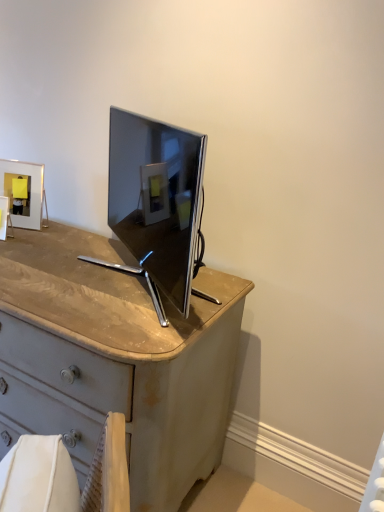
Where is `matte white picture frame at upper left, positioned as the first picture frame in front-to-back order`? The width and height of the screenshot is (384, 512). matte white picture frame at upper left, positioned as the first picture frame in front-to-back order is located at coordinates (3, 217).

The width and height of the screenshot is (384, 512). What do you see at coordinates (3, 217) in the screenshot?
I see `matte white picture frame at upper left, the 2th picture frame from the back` at bounding box center [3, 217].

Find the location of a particular element. This screenshot has width=384, height=512. matte silver picture frame at upper left, arranged as the 2th picture frame when viewed from the front is located at coordinates (23, 192).

What is the approximate height of matte silver picture frame at upper left, arranged as the 2th picture frame when viewed from the front?

The height of matte silver picture frame at upper left, arranged as the 2th picture frame when viewed from the front, is 10.74 inches.

This screenshot has height=512, width=384. Describe the element at coordinates (23, 192) in the screenshot. I see `matte silver picture frame at upper left, arranged as the 2th picture frame when viewed from the front` at that location.

Find the location of a particular element. matte white picture frame at upper left, the 2th picture frame from the back is located at coordinates (3, 217).

Which is more to the right, matte white picture frame at upper left, positioned as the first picture frame in front-to-back order, or matte silver picture frame at upper left, the first picture frame viewed from the back?

Positioned to the right is matte silver picture frame at upper left, the first picture frame viewed from the back.

Looking at this image, is matte white picture frame at upper left, the 2th picture frame from the back, in front of matte silver picture frame at upper left, arranged as the 2th picture frame when viewed from the front?

Yes.

Which is in front, point (5, 209) or point (6, 187)?

The point (5, 209) is closer to the camera.

From the image's perspective, who appears lower, matte white picture frame at upper left, the 2th picture frame from the back, or matte silver picture frame at upper left, arranged as the 2th picture frame when viewed from the front?

matte white picture frame at upper left, the 2th picture frame from the back.

From the picture: From a real-world perspective, who is located lower, matte white picture frame at upper left, positioned as the first picture frame in front-to-back order, or matte silver picture frame at upper left, the first picture frame viewed from the back?

matte white picture frame at upper left, positioned as the first picture frame in front-to-back order.

In terms of width, does matte white picture frame at upper left, positioned as the first picture frame in front-to-back order, look wider or thinner when compared to matte silver picture frame at upper left, the first picture frame viewed from the back?

Considering their sizes, matte white picture frame at upper left, positioned as the first picture frame in front-to-back order, looks slimmer than matte silver picture frame at upper left, the first picture frame viewed from the back.

Does matte white picture frame at upper left, positioned as the first picture frame in front-to-back order, have a lesser height compared to matte silver picture frame at upper left, the first picture frame viewed from the back?

Yes.

Is matte white picture frame at upper left, the 2th picture frame from the back, bigger or smaller than matte silver picture frame at upper left, arranged as the 2th picture frame when viewed from the front?

Clearly, matte white picture frame at upper left, the 2th picture frame from the back, is smaller in size than matte silver picture frame at upper left, arranged as the 2th picture frame when viewed from the front.

Which is correct: matte white picture frame at upper left, positioned as the first picture frame in front-to-back order, is inside matte silver picture frame at upper left, arranged as the 2th picture frame when viewed from the front, or outside of it?

The correct answer is: outside.

Is matte white picture frame at upper left, positioned as the first picture frame in front-to-back order, not near matte silver picture frame at upper left, the first picture frame viewed from the back?

matte white picture frame at upper left, positioned as the first picture frame in front-to-back order, is actually quite close to matte silver picture frame at upper left, the first picture frame viewed from the back.

Is matte white picture frame at upper left, the 2th picture frame from the back, turned away from matte silver picture frame at upper left, arranged as the 2th picture frame when viewed from the front?

Yes, matte white picture frame at upper left, the 2th picture frame from the back, is positioned with its back facing matte silver picture frame at upper left, arranged as the 2th picture frame when viewed from the front.

What's the angular difference between matte white picture frame at upper left, positioned as the first picture frame in front-to-back order, and matte silver picture frame at upper left, the first picture frame viewed from the back,'s facing directions?

The facing directions of matte white picture frame at upper left, positioned as the first picture frame in front-to-back order, and matte silver picture frame at upper left, the first picture frame viewed from the back, are 5.78 degrees apart.

How distant is matte white picture frame at upper left, positioned as the first picture frame in front-to-back order, from matte silver picture frame at upper left, the first picture frame viewed from the back?

The distance of matte white picture frame at upper left, positioned as the first picture frame in front-to-back order, from matte silver picture frame at upper left, the first picture frame viewed from the back, is 3.46 inches.

Where is `picture frame on the right of matte white picture frame at upper left, positioned as the first picture frame in front-to-back order`? This screenshot has width=384, height=512. picture frame on the right of matte white picture frame at upper left, positioned as the first picture frame in front-to-back order is located at coordinates (23, 192).

Does matte silver picture frame at upper left, the first picture frame viewed from the back, appear on the right side of matte white picture frame at upper left, positioned as the first picture frame in front-to-back order?

Indeed, matte silver picture frame at upper left, the first picture frame viewed from the back, is positioned on the right side of matte white picture frame at upper left, positioned as the first picture frame in front-to-back order.

Is matte silver picture frame at upper left, arranged as the 2th picture frame when viewed from the front, behind matte white picture frame at upper left, the 2th picture frame from the back?

Yes, the depth of matte silver picture frame at upper left, arranged as the 2th picture frame when viewed from the front, is greater than that of matte white picture frame at upper left, the 2th picture frame from the back.

Which is nearer, (28,208) or (2,203)?

Clearly, point (28,208) is more distant from the camera than point (2,203).

From the image's perspective, which one is positioned higher, matte silver picture frame at upper left, arranged as the 2th picture frame when viewed from the front, or matte white picture frame at upper left, the 2th picture frame from the back?

matte silver picture frame at upper left, arranged as the 2th picture frame when viewed from the front.

From a real-world perspective, which is physically above, matte silver picture frame at upper left, arranged as the 2th picture frame when viewed from the front, or matte white picture frame at upper left, positioned as the first picture frame in front-to-back order?

matte silver picture frame at upper left, arranged as the 2th picture frame when viewed from the front, from a real-world perspective.

Which object is thinner, matte silver picture frame at upper left, arranged as the 2th picture frame when viewed from the front, or matte white picture frame at upper left, positioned as the first picture frame in front-to-back order?

With smaller width is matte white picture frame at upper left, positioned as the first picture frame in front-to-back order.

Between matte silver picture frame at upper left, the first picture frame viewed from the back, and matte white picture frame at upper left, positioned as the first picture frame in front-to-back order, which one has less height?

matte white picture frame at upper left, positioned as the first picture frame in front-to-back order, is shorter.

Looking at the image, does matte silver picture frame at upper left, arranged as the 2th picture frame when viewed from the front, seem bigger or smaller compared to matte white picture frame at upper left, the 2th picture frame from the back?

Considering their sizes, matte silver picture frame at upper left, arranged as the 2th picture frame when viewed from the front, takes up more space than matte white picture frame at upper left, the 2th picture frame from the back.

Is matte white picture frame at upper left, the 2th picture frame from the back, inside matte silver picture frame at upper left, arranged as the 2th picture frame when viewed from the front?

No, matte white picture frame at upper left, the 2th picture frame from the back, is not surrounded by matte silver picture frame at upper left, arranged as the 2th picture frame when viewed from the front.

Is matte silver picture frame at upper left, the first picture frame viewed from the back, far from matte white picture frame at upper left, positioned as the first picture frame in front-to-back order?

That's not correct — matte silver picture frame at upper left, the first picture frame viewed from the back, is a little close to matte white picture frame at upper left, positioned as the first picture frame in front-to-back order.

Is matte silver picture frame at upper left, the first picture frame viewed from the back, positioned with its back to matte white picture frame at upper left, positioned as the first picture frame in front-to-back order?

Yes, matte silver picture frame at upper left, the first picture frame viewed from the back, is facing away from matte white picture frame at upper left, positioned as the first picture frame in front-to-back order.

How many degrees apart are the facing directions of matte silver picture frame at upper left, arranged as the 2th picture frame when viewed from the front, and matte white picture frame at upper left, the 2th picture frame from the back?

The angular difference between matte silver picture frame at upper left, arranged as the 2th picture frame when viewed from the front, and matte white picture frame at upper left, the 2th picture frame from the back, is 5.78 degrees.

Identify the location of picture frame above the matte white picture frame at upper left, the 2th picture frame from the back (from the image's perspective). (23, 192).

Locate an element on the screen. picture frame on the right of the matte white picture frame at upper left, positioned as the first picture frame in front-to-back order is located at coordinates (23, 192).

The image size is (384, 512). I want to click on picture frame located underneath the matte silver picture frame at upper left, the first picture frame viewed from the back (from a real-world perspective), so click(x=3, y=217).